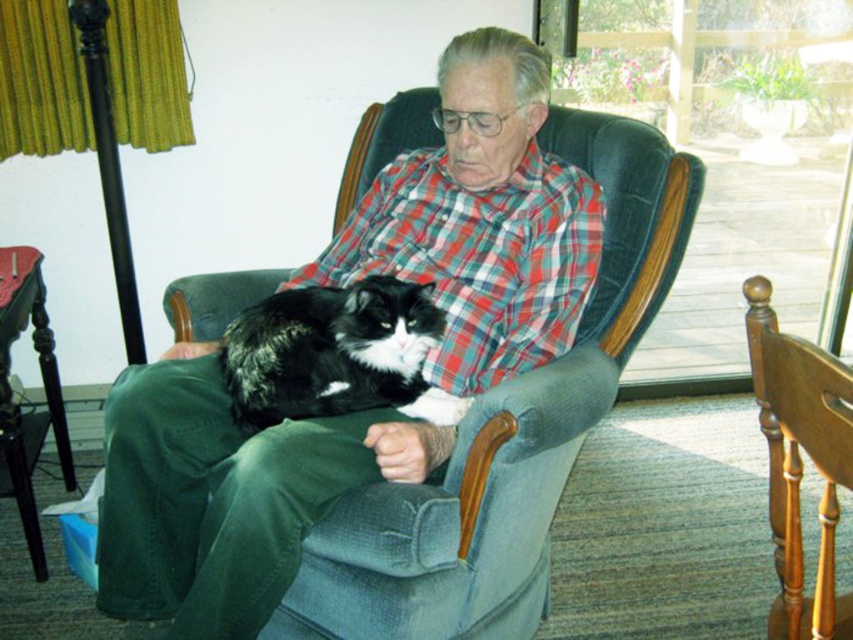
Consider the image. You are standing in the living room and want to reach the wooden chair at center. There is a plaid cotton shirt at center in the way. Can you walk around it to get to the chair?

The plaid cotton shirt at center is further to the viewer than wooden chair at center, so the shirt is closer to you. You can walk around the plaid cotton shirt at center to reach the wooden chair at center behind it.

Consider the image. You are a photographer trying to capture a closeup of the plaid cotton shirt at center and the black fluffy cat at center. Which object is positioned closer to the camera?

The plaid cotton shirt at center is closer to the viewer than the black fluffy cat at center, so the camera would capture it first.

You are an interior designer assessing the living room layout. The plaid cotton shirt at center and wooden chair at center are both in the room. Which object has a greater height?

The plaid cotton shirt at center is much taller than the wooden chair at center.